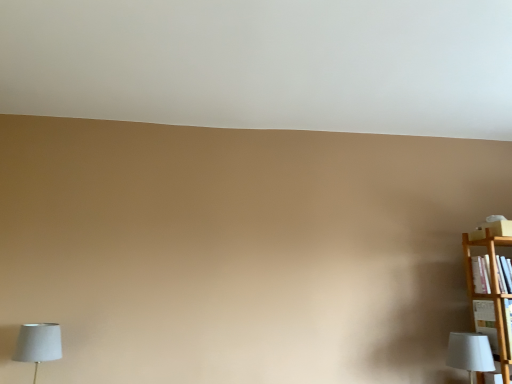
Describe the element at coordinates (481, 274) in the screenshot. The width and height of the screenshot is (512, 384). I see `wooden bookshelf at right` at that location.

The image size is (512, 384). What do you see at coordinates (470, 353) in the screenshot?
I see `white fabric lampshade at lower right, the first lamp viewed from the right` at bounding box center [470, 353].

You are a GUI agent. You are given a task and a screenshot of the screen. Output one action in this format:
    pyautogui.click(x=<x>, y=<y>)
    Task: Click on the white fabric lampshade at lower left, the first lamp when ordered from left to right
    The image size is (512, 384).
    Given the screenshot: What is the action you would take?
    pyautogui.click(x=38, y=344)

Is point (487, 256) positioned behind point (469, 357)?

Yes, point (487, 256) is farther from viewer.

Is wooden bookshelf at right further to the viewer compared to white fabric lampshade at lower right, the second lamp positioned from the left?

Yes.

From a real-world perspective, relative to white fabric lampshade at lower right, the first lamp viewed from the right, is wooden bookshelf at right vertically above or below?

From a real-world perspective, wooden bookshelf at right is physically above white fabric lampshade at lower right, the first lamp viewed from the right.

Considering the relative sizes of white fabric lampshade at lower left, the first lamp when ordered from left to right, and white fabric lampshade at lower right, the second lamp positioned from the left, in the image provided, is white fabric lampshade at lower left, the first lamp when ordered from left to right, thinner than white fabric lampshade at lower right, the second lamp positioned from the left,?

No.

Consider the image. Is white fabric lampshade at lower left, the first lamp when ordered from left to right, far away from white fabric lampshade at lower right, the second lamp positioned from the left?

Yes, white fabric lampshade at lower left, the first lamp when ordered from left to right, is far from white fabric lampshade at lower right, the second lamp positioned from the left.

Identify the location of lamp below the white fabric lampshade at lower right, the first lamp viewed from the right (from a real-world perspective). The width and height of the screenshot is (512, 384). (38, 344).

Starting from the wooden bookshelf at right, which lamp is the 2nd one to the left? Please provide its 2D coordinates.

[(38, 344)]

Could you tell me if wooden bookshelf at right is turned towards white fabric lampshade at lower left, positioned as the 2th lamp in right-to-left order?

No, wooden bookshelf at right is not facing towards white fabric lampshade at lower left, positioned as the 2th lamp in right-to-left order.

From the picture: In terms of height, does wooden bookshelf at right look taller or shorter compared to white fabric lampshade at lower left, positioned as the 2th lamp in right-to-left order?

In the image, wooden bookshelf at right appears to be shorter than white fabric lampshade at lower left, positioned as the 2th lamp in right-to-left order.

From a real-world perspective, is wooden bookshelf at right physically located above or below white fabric lampshade at lower left, positioned as the 2th lamp in right-to-left order?

wooden bookshelf at right is situated higher than white fabric lampshade at lower left, positioned as the 2th lamp in right-to-left order, in the real world.

From the image's perspective, which one is positioned higher, white fabric lampshade at lower right, the first lamp viewed from the right, or white fabric lampshade at lower left, positioned as the 2th lamp in right-to-left order?

From the image's view, white fabric lampshade at lower left, positioned as the 2th lamp in right-to-left order, is above.

How far apart are white fabric lampshade at lower right, the second lamp positioned from the left, and white fabric lampshade at lower left, positioned as the 2th lamp in right-to-left order?

white fabric lampshade at lower right, the second lamp positioned from the left, is 6.99 feet away from white fabric lampshade at lower left, positioned as the 2th lamp in right-to-left order.

Can you confirm if white fabric lampshade at lower right, the second lamp positioned from the left, is smaller than white fabric lampshade at lower left, positioned as the 2th lamp in right-to-left order?

Correct, white fabric lampshade at lower right, the second lamp positioned from the left, occupies less space than white fabric lampshade at lower left, positioned as the 2th lamp in right-to-left order.

Which point is more distant from viewer, (485, 338) or (29, 347)?

The point (485, 338) is more distant.

Is white fabric lampshade at lower right, the first lamp viewed from the right, thinner than wooden bookshelf at right?

No, white fabric lampshade at lower right, the first lamp viewed from the right, is not thinner than wooden bookshelf at right.

Who is shorter, white fabric lampshade at lower right, the second lamp positioned from the left, or wooden bookshelf at right?

With less height is wooden bookshelf at right.

In the scene shown: Is white fabric lampshade at lower right, the second lamp positioned from the left, at the right side of wooden bookshelf at right?

In fact, white fabric lampshade at lower right, the second lamp positioned from the left, is to the left of wooden bookshelf at right.

Which of these two, white fabric lampshade at lower right, the first lamp viewed from the right, or wooden bookshelf at right, is smaller?

wooden bookshelf at right.

Considering the positions of objects white fabric lampshade at lower left, positioned as the 2th lamp in right-to-left order, and wooden bookshelf at right in the image provided, who is more to the left, white fabric lampshade at lower left, positioned as the 2th lamp in right-to-left order, or wooden bookshelf at right?

white fabric lampshade at lower left, positioned as the 2th lamp in right-to-left order.

Between white fabric lampshade at lower left, the first lamp when ordered from left to right, and wooden bookshelf at right, which one has less height?

wooden bookshelf at right is shorter.

From a real-world perspective, which is physically below, white fabric lampshade at lower left, the first lamp when ordered from left to right, or wooden bookshelf at right?

white fabric lampshade at lower left, the first lamp when ordered from left to right.

Is white fabric lampshade at lower left, positioned as the 2th lamp in right-to-left order, oriented towards wooden bookshelf at right?

No, white fabric lampshade at lower left, positioned as the 2th lamp in right-to-left order, is not turned towards wooden bookshelf at right.

From the image's perspective, starting from the wooden bookshelf at right, which lamp is the 2nd one below? Please provide its 2D coordinates.

[(470, 353)]

Image resolution: width=512 pixels, height=384 pixels. What are the coordinates of `lamp on the right of white fabric lampshade at lower left, positioned as the 2th lamp in right-to-left order` in the screenshot? It's located at coord(470,353).

Estimate the real-world distances between objects in this image. Which object is further from white fabric lampshade at lower right, the second lamp positioned from the left, wooden bookshelf at right or white fabric lampshade at lower left, positioned as the 2th lamp in right-to-left order?

Based on the image, white fabric lampshade at lower left, positioned as the 2th lamp in right-to-left order, appears to be further to white fabric lampshade at lower right, the second lamp positioned from the left.

Based on the photo, considering their positions, is white fabric lampshade at lower left, the first lamp when ordered from left to right, positioned further to wooden bookshelf at right than white fabric lampshade at lower right, the first lamp viewed from the right?

white fabric lampshade at lower left, the first lamp when ordered from left to right, is further to wooden bookshelf at right.

Which object lies nearer to the anchor point wooden bookshelf at right, white fabric lampshade at lower right, the second lamp positioned from the left, or white fabric lampshade at lower left, positioned as the 2th lamp in right-to-left order?

white fabric lampshade at lower right, the second lamp positioned from the left, is positioned closer to the anchor wooden bookshelf at right.

Which object lies further to the anchor point white fabric lampshade at lower right, the second lamp positioned from the left, white fabric lampshade at lower left, the first lamp when ordered from left to right, or wooden bookshelf at right?

Among the two, white fabric lampshade at lower left, the first lamp when ordered from left to right, is located further to white fabric lampshade at lower right, the second lamp positioned from the left.

Which object lies nearer to the anchor point white fabric lampshade at lower left, the first lamp when ordered from left to right, white fabric lampshade at lower right, the first lamp viewed from the right, or wooden bookshelf at right?

Based on the image, white fabric lampshade at lower right, the first lamp viewed from the right, appears to be nearer to white fabric lampshade at lower left, the first lamp when ordered from left to right.

When comparing their distances from white fabric lampshade at lower left, the first lamp when ordered from left to right, does wooden bookshelf at right or white fabric lampshade at lower right, the first lamp viewed from the right, seem closer?

white fabric lampshade at lower right, the first lamp viewed from the right, is closer to white fabric lampshade at lower left, the first lamp when ordered from left to right.

Where is `lamp between white fabric lampshade at lower left, the first lamp when ordered from left to right, and wooden bookshelf at right, in the horizontal direction`? The width and height of the screenshot is (512, 384). lamp between white fabric lampshade at lower left, the first lamp when ordered from left to right, and wooden bookshelf at right, in the horizontal direction is located at coordinates (470, 353).